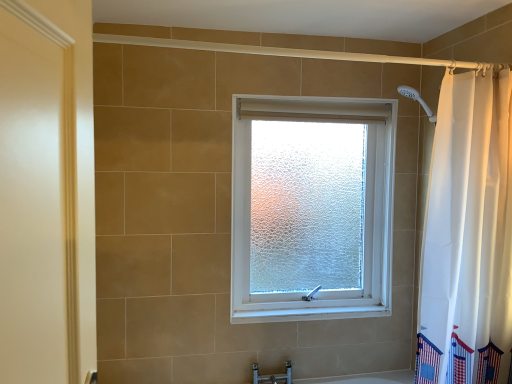
I want to click on white fabric curtain at right, so click(x=469, y=220).

You are a GUI agent. You are given a task and a screenshot of the screen. Output one action in this format:
    pyautogui.click(x=<x>, y=<y>)
    Task: Click on the matte silver faucet at lower center
    
    Given the screenshot: What is the action you would take?
    pyautogui.click(x=273, y=376)

Is point (232, 259) positioned after point (291, 382)?

No, it is not.

Which of these two, frosted glass window at center or matte silver faucet at lower center, is wider?

With larger width is frosted glass window at center.

From the picture: Is frosted glass window at center smaller than matte silver faucet at lower center?

Actually, frosted glass window at center might be larger than matte silver faucet at lower center.

I want to click on curtain above the frosted glass window at center (from a real-world perspective), so click(469, 220).

From a real-world perspective, between white fabric curtain at right and frosted glass window at center, who is vertically higher?

From a 3D spatial view, white fabric curtain at right is above.

Is white fabric curtain at right touching frosted glass window at center?

There is a gap between white fabric curtain at right and frosted glass window at center.

How different are the orientations of white fabric curtain at right and frosted glass window at center in degrees?

90.3 degrees.

From the image's perspective, relative to frosted glass window at center, is matte silver faucet at lower center above or below?

Based on their image positions, matte silver faucet at lower center is located beneath frosted glass window at center.

Is matte silver faucet at lower center taller or shorter than frosted glass window at center?

Clearly, matte silver faucet at lower center is shorter compared to frosted glass window at center.

Considering the positions of objects matte silver faucet at lower center and frosted glass window at center in the image provided, who is more to the right, matte silver faucet at lower center or frosted glass window at center?

frosted glass window at center.

In the image, there is a frosted glass window at center. At what (x,y) coordinates should I click in order to perform the action: click on faucet below it (from a real-world perspective). Please return your answer as a coordinate pair (x, y). Looking at the image, I should click on (273, 376).

Considering the relative sizes of frosted glass window at center and white fabric curtain at right in the image provided, is frosted glass window at center bigger than white fabric curtain at right?

Indeed, frosted glass window at center has a larger size compared to white fabric curtain at right.

From the image's perspective, relative to white fabric curtain at right, is frosted glass window at center above or below?

Based on their image positions, frosted glass window at center is located beneath white fabric curtain at right.

Can we say frosted glass window at center lies outside white fabric curtain at right?

Yes, frosted glass window at center is not within white fabric curtain at right.

Considering the relative positions of frosted glass window at center and white fabric curtain at right in the image provided, is frosted glass window at center to the left or to the right of white fabric curtain at right?

In the image, frosted glass window at center appears on the left side of white fabric curtain at right.

Which of these two, white fabric curtain at right or matte silver faucet at lower center, is smaller?

Smaller between the two is matte silver faucet at lower center.

Considering the sizes of objects white fabric curtain at right and matte silver faucet at lower center in the image provided, who is wider, white fabric curtain at right or matte silver faucet at lower center?

white fabric curtain at right is wider.

Is white fabric curtain at right oriented towards matte silver faucet at lower center?

No, white fabric curtain at right is not turned towards matte silver faucet at lower center.

Which is farther from the camera, (450, 360) or (268, 376)?

Positioned behind is point (268, 376).

Does matte silver faucet at lower center lie in front of white fabric curtain at right?

No, matte silver faucet at lower center is further to the viewer.

Considering the points (264, 378) and (474, 215), which point is behind, point (264, 378) or point (474, 215)?

The point (264, 378) is farther from the camera.

Considering the sizes of objects matte silver faucet at lower center and white fabric curtain at right in the image provided, who is shorter, matte silver faucet at lower center or white fabric curtain at right?

With less height is matte silver faucet at lower center.

This screenshot has width=512, height=384. There is a matte silver faucet at lower center. What are the coordinates of `window above it (from a real-world perspective)` in the screenshot? It's located at (364, 206).

The height and width of the screenshot is (384, 512). Identify the location of window that is behind the white fabric curtain at right. (364, 206).

From the image, which object appears to be nearer to matte silver faucet at lower center, frosted glass window at center or white fabric curtain at right?

Among the two, frosted glass window at center is located nearer to matte silver faucet at lower center.

Which object lies further to the anchor point matte silver faucet at lower center, white fabric curtain at right or frosted glass window at center?

The object further to matte silver faucet at lower center is white fabric curtain at right.

From the image, which object appears to be farther from white fabric curtain at right, frosted glass window at center or matte silver faucet at lower center?

Among the two, matte silver faucet at lower center is located further to white fabric curtain at right.

In the scene shown: Which object lies further to the anchor point frosted glass window at center, white fabric curtain at right or matte silver faucet at lower center?

Based on the image, matte silver faucet at lower center appears to be further to frosted glass window at center.

Looking at the image, which one is located closer to white fabric curtain at right, matte silver faucet at lower center or frosted glass window at center?

frosted glass window at center lies closer to white fabric curtain at right than the other object.

Considering their positions, is matte silver faucet at lower center positioned further to frosted glass window at center than white fabric curtain at right?

Among the two, matte silver faucet at lower center is located further to frosted glass window at center.

Locate an element on the screen. window between white fabric curtain at right and matte silver faucet at lower center from top to bottom is located at coordinates (364, 206).